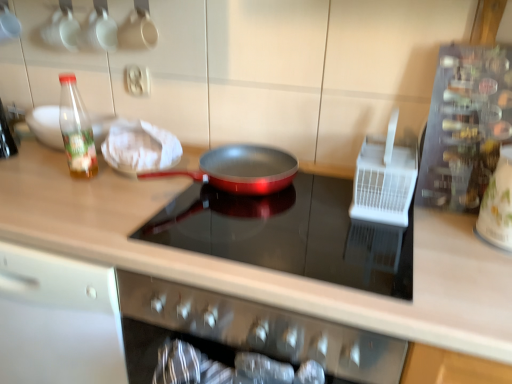
The height and width of the screenshot is (384, 512). Find the location of `free space above matte wood countertop at center (from a real-world perspective)`. free space above matte wood countertop at center (from a real-world perspective) is located at coordinates [x=234, y=215].